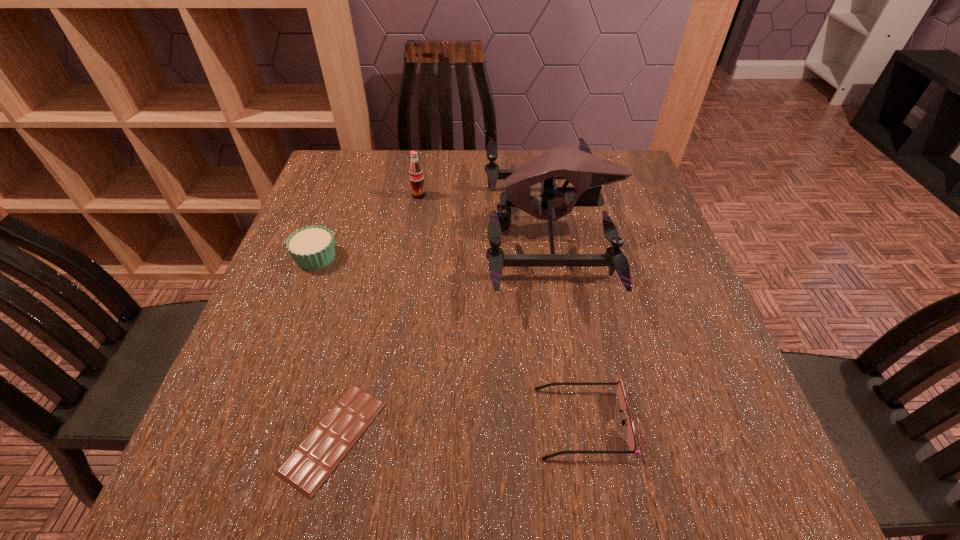
Point out which object is positioned as the nearest to the leftmost object. Please provide its 2D coordinates. Your answer should be formatted as a tuple, i.e. [(x, y)], where the tuple contains the x and y coordinates of a point satisfying the conditions above.

[(416, 175)]

Where is `free spot that satisfies the following two spatial constraints: 1. on the front side of the shortest object; 2. on the left side of the cupcake`? The height and width of the screenshot is (540, 960). free spot that satisfies the following two spatial constraints: 1. on the front side of the shortest object; 2. on the left side of the cupcake is located at coordinates (249, 436).

I want to click on vacant space that satisfies the following two spatial constraints: 1. on the front-facing side of the tallest object; 2. on the front side of the shortest object, so click(x=586, y=436).